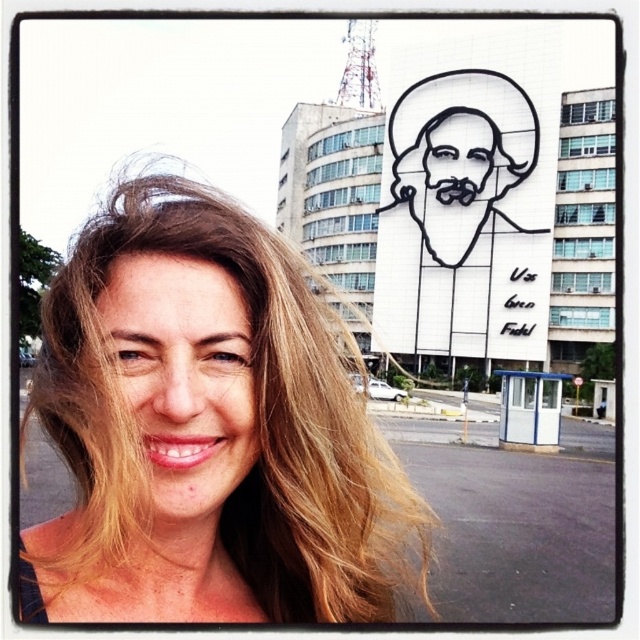
Question: Which of these objects is positioned closest to the black outline mural at upper center?

Choices:
 (A) blonde hair at center
 (B) black outline face at upper center

Answer: (B)

Question: Can you confirm if blonde hair at center is thinner than smooth skin face at center?

Choices:
 (A) yes
 (B) no

Answer: (B)

Question: Which point is closer to the camera taking this photo?

Choices:
 (A) (240, 426)
 (B) (236, 356)
 (C) (449, 156)
 (D) (483, 278)

Answer: (A)

Question: Is the position of black outline mural at upper center less distant than that of smooth skin face at center?

Choices:
 (A) yes
 (B) no

Answer: (B)

Question: Which is nearer to the black outline face at upper center?

Choices:
 (A) black outline mural at upper center
 (B) smooth skin face at center
 (C) blonde hair at center

Answer: (A)

Question: Does blonde hair at center come behind black outline mural at upper center?

Choices:
 (A) no
 (B) yes

Answer: (A)